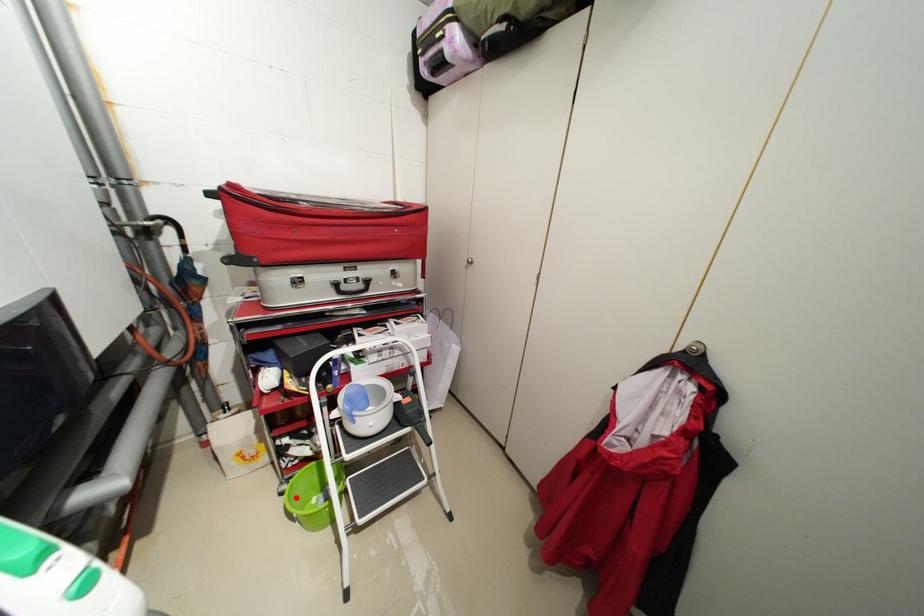
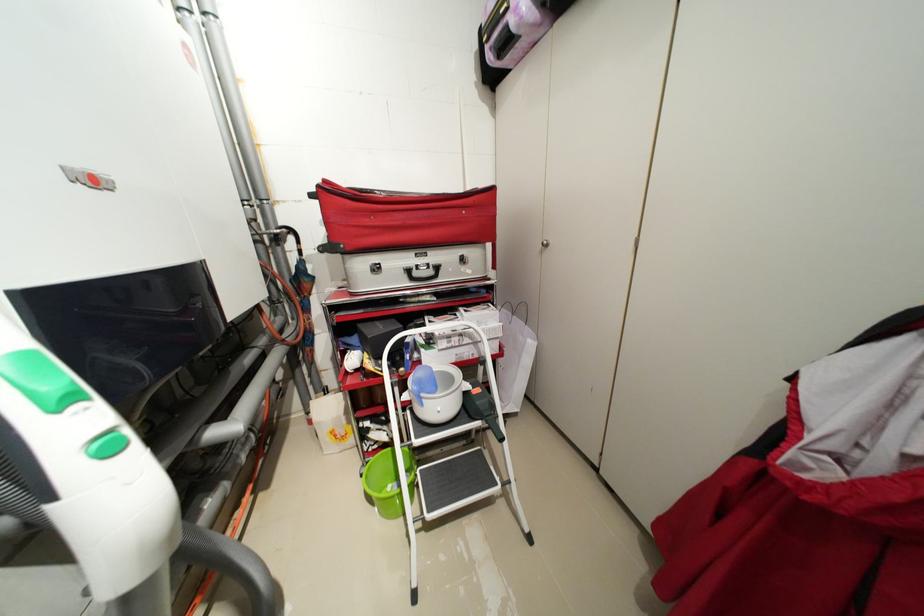
In the second image, find the point that corresponds to the highlighted location in the first image.

(373, 479)